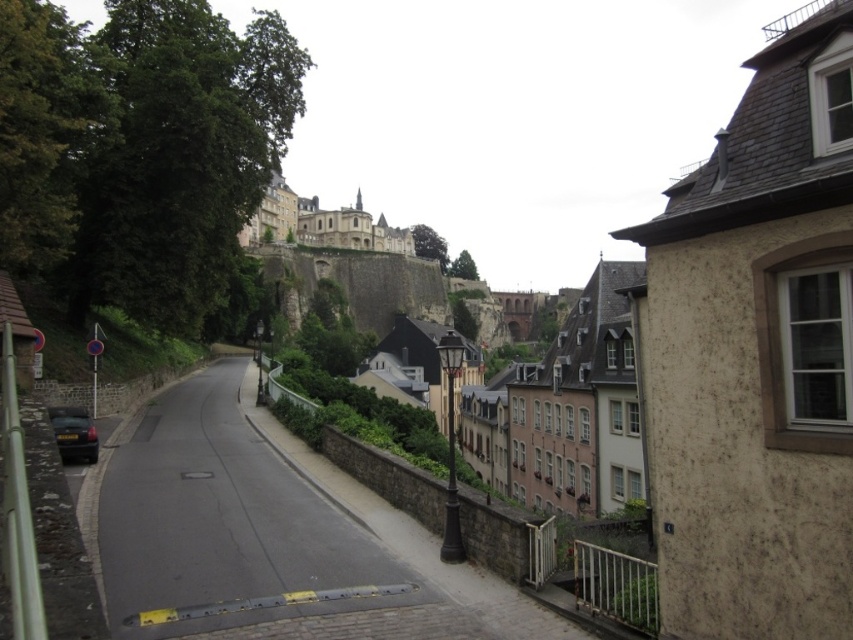
Who is higher up, brown rough stone wall at right or metallic gray car at lower left?

Positioned higher is brown rough stone wall at right.

Who is positioned more to the left, brown rough stone wall at right or metallic gray car at lower left?

From the viewer's perspective, metallic gray car at lower left appears more on the left side.

Between point (770, 524) and point (68, 428), which one is positioned behind?

The point (68, 428) is behind.

Where is `brown rough stone wall at right`? Image resolution: width=853 pixels, height=640 pixels. brown rough stone wall at right is located at coordinates (757, 355).